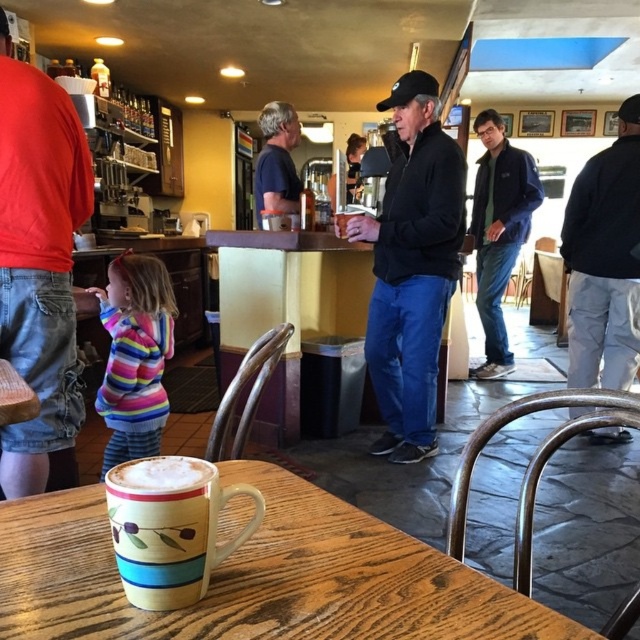
Does striped fleece jacket at left lie in front of matte ceramic mug at lower center?

No, it is behind matte ceramic mug at lower center.

Is striped fleece jacket at left above matte ceramic mug at lower center?

Actually, striped fleece jacket at left is below matte ceramic mug at lower center.

Describe the element at coordinates (134, 355) in the screenshot. I see `striped fleece jacket at left` at that location.

Identify the location of striped fleece jacket at left. (134, 355).

Is point (35, 81) positioned behind point (486, 195)?

No, it is not.

Is red cotton shirt at left positioned behind dark blue jacket at center?

No, red cotton shirt at left is closer to the viewer.

Locate an element on the screen. red cotton shirt at left is located at coordinates (38, 262).

Who is more distant from viewer, (602, 340) or (275, 179)?

Point (275, 179)

Which is in front, point (632, 109) or point (280, 129)?

Point (632, 109) is more forward.

Which is in front, point (572, 259) or point (276, 180)?

Point (572, 259)

At what (x,y) coordinates should I click in order to perform the action: click on dark blue jacket at right. Please return your answer as a coordinate pair (x, y). Looking at the image, I should click on (604, 260).